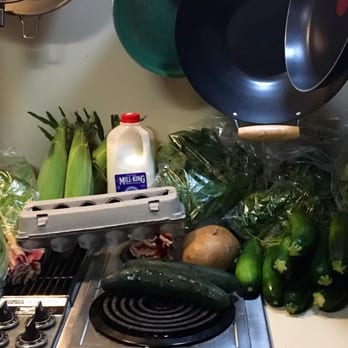
Where is `white back wall`? white back wall is located at coordinates (86, 77).